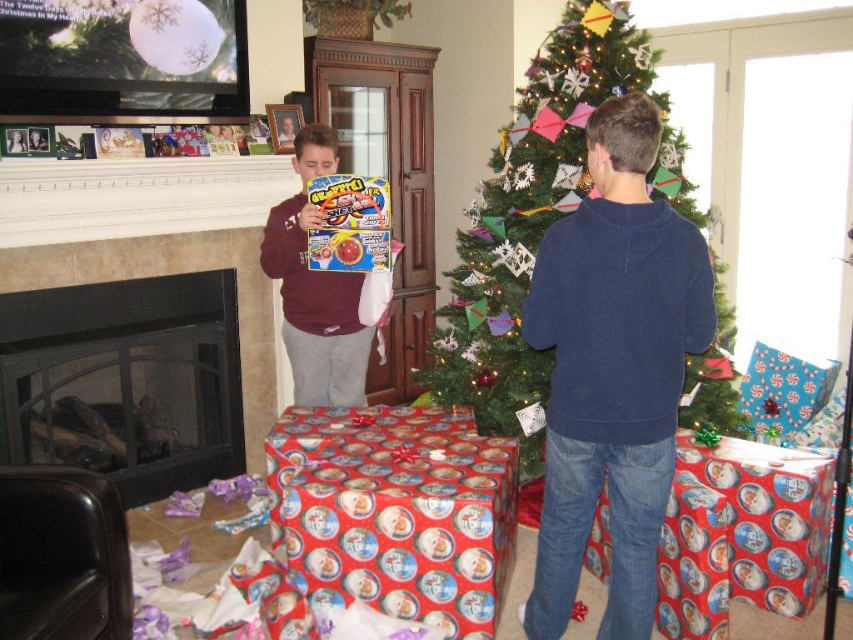
You are a guest at this Christmas party and want to place a gift under the green matte christmas tree at center. To do so, you need to walk around the black glass fireplace at lower left. Which direction should you move relative to the fireplace to reach the tree?

The green matte christmas tree at center is further to the viewer than the black glass fireplace at lower left, so you should move forward away from the fireplace to reach the tree.

You are standing in the living room and want to place a new painting on the wall behind the black glass fireplace at lower left and the maroon fleece sweater at center. Which object should you move first to access the wall space behind it?

You should move the black glass fireplace at lower left first because it is closer to you than the maroon fleece sweater at center, so you need to move it first to access the wall behind it.